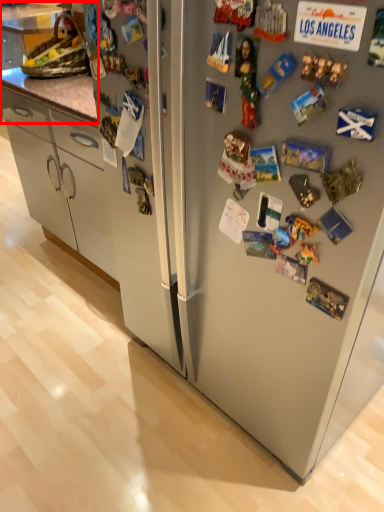
Question: From the image's perspective, considering the relative positions of counter top (annotated by the red box) and refrigerator in the image provided, where is counter top (annotated by the red box) located with respect to the staircase?

Choices:
 (A) above
 (B) below

Answer: (A)